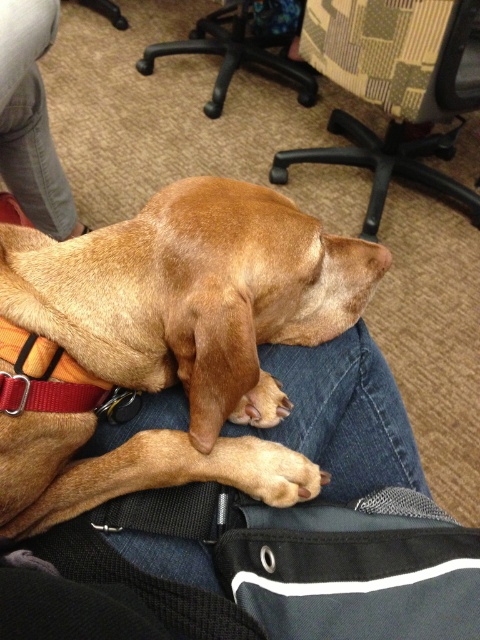
Question: Is brown fur dog at center further to the viewer compared to black plastic chair at upper center?

Choices:
 (A) yes
 (B) no

Answer: (B)

Question: Among these points, which one is nearest to the camera?

Choices:
 (A) (33, 61)
 (B) (379, 35)

Answer: (A)

Question: Is brown fur dog at center smaller than patterned fabric chair at upper center?

Choices:
 (A) yes
 (B) no

Answer: (A)

Question: Which is farther from the denim pants at lower left?

Choices:
 (A) patterned fabric chair at upper center
 (B) black plastic chair at upper center

Answer: (B)

Question: Among these objects, which one is nearest to the camera?

Choices:
 (A) patterned fabric chair at upper center
 (B) denim pants at lower left

Answer: (B)

Question: Is brown fur dog at center wider than patterned fabric chair at upper center?

Choices:
 (A) no
 (B) yes

Answer: (A)